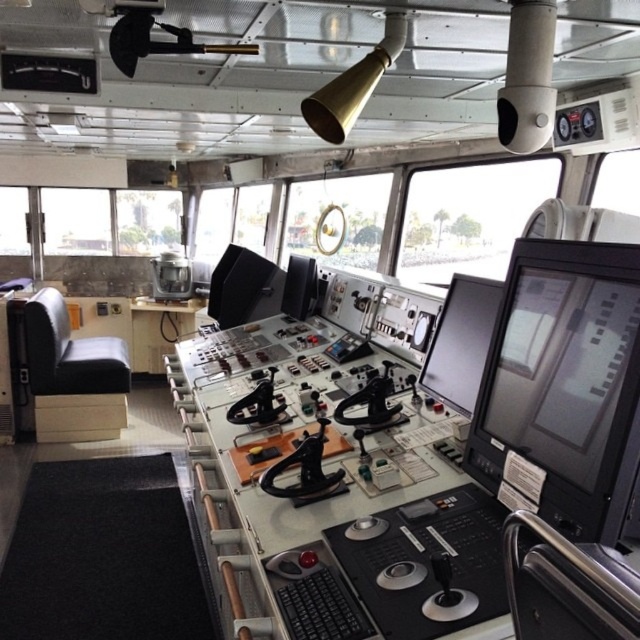
Based on the photo, who is taller, black glossy monitor at center right or black glossy monitor at center?

Standing taller between the two is black glossy monitor at center right.

Does black glossy monitor at center right have a lesser width compared to black glossy monitor at center?

Incorrect, black glossy monitor at center right's width is not less than black glossy monitor at center's.

This screenshot has width=640, height=640. What are the coordinates of `black glossy monitor at center right` in the screenshot? It's located at (563, 387).

In order to click on black glossy monitor at center right in this screenshot , I will do `click(563, 387)`.

Who is taller, black glossy monitor at center right or matte black monitor at center?

With more height is matte black monitor at center.

Can you confirm if black glossy monitor at center right is positioned above matte black monitor at center?

No.

Where is `black glossy monitor at center right`? The height and width of the screenshot is (640, 640). black glossy monitor at center right is located at coordinates (563, 387).

Does black glossy monitor at center have a lesser width compared to matte black monitor at center?

Yes.

How much distance is there between black glossy monitor at center and matte black monitor at center?

The distance of black glossy monitor at center from matte black monitor at center is 2.41 meters.

Find the location of a particular element. This screenshot has width=640, height=640. black glossy monitor at center is located at coordinates (460, 340).